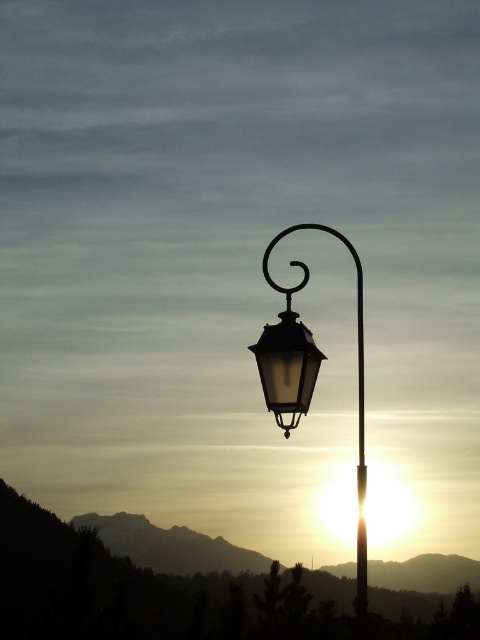
You are a city planner assessing the placement of the matte glass street light at center and the metallic pole at center. Based on the scene, which object is positioned higher in the image?

The matte glass street light at center is located above the metallic pole at center, so it is positioned higher in the image.

You are an urban planner assessing the placement of the matte glass street light at center and the matte black lantern at center. Given their sizes, which one might require more horizontal space to avoid blocking pedestrian pathways?

The matte glass street light at center requires more horizontal space since its width is larger than the matte black lantern at center, ensuring it doesn not block pedestrian pathways.

You are a city planner assessing the placement of the matte black lantern at center and the metallic pole at center in the image. Considering their heights, which object would require a taller structure for installation?

The metallic pole at center requires a taller structure for installation because the matte black lantern at center is shorter than the metallic pole at center.